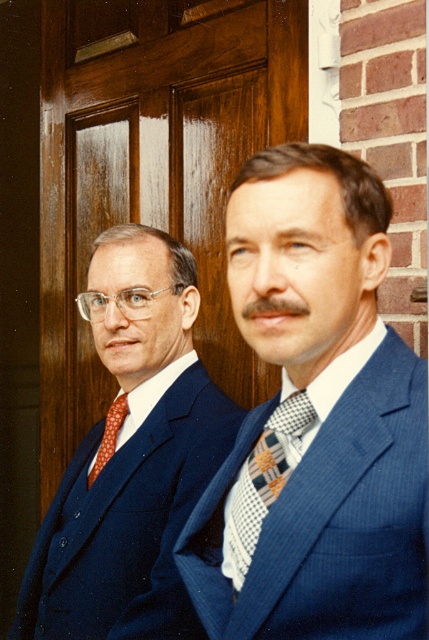
Question: Is wooden at center further to the viewer compared to matte blue suit at left?

Choices:
 (A) no
 (B) yes

Answer: (B)

Question: In this image, where is matte blue suit at left located relative to polka dot silk tie at left?

Choices:
 (A) below
 (B) above

Answer: (B)

Question: Which of the following is the closest to the observer?

Choices:
 (A) blue textured suit at center
 (B) wooden at center
 (C) polka dot silk tie at left

Answer: (A)

Question: Is the position of matte blue suit at left less distant than that of polka dot silk tie at left?

Choices:
 (A) no
 (B) yes

Answer: (B)

Question: Among these points, which one is nearest to the camera?

Choices:
 (A) (262, 132)
 (B) (280, 547)
 (C) (106, 364)

Answer: (B)

Question: Considering the real-world distances, which object is closest to the wooden at center?

Choices:
 (A) matte blue suit at left
 (B) checkered fabric tie at center
 (C) polka dot silk tie at left

Answer: (A)